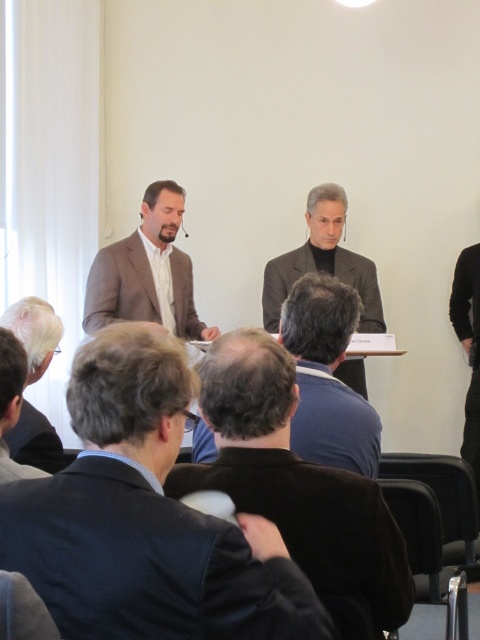
Question: Based on their relative distances, which object is farther from the black velvet jacket at center?

Choices:
 (A) dark brown suit at lower left
 (B) black fabric jacket at right
 (C) dark gray wool suit at lower left
 (D) dark brown hair at center

Answer: (B)

Question: Estimate the real-world distances between objects in this image. Which object is farther from the matte brown suit at center?

Choices:
 (A) dark brown hair at center
 (B) dark gray textured suit at center
 (C) dark brown suit at lower left

Answer: (C)

Question: Can you confirm if dark gray textured suit at center is bigger than dark gray wool suit at lower left?

Choices:
 (A) no
 (B) yes

Answer: (B)

Question: Which point is farther from the camera taking this photo?

Choices:
 (A) (32, 429)
 (B) (347, 272)
 (C) (46, 580)

Answer: (B)

Question: Does black velvet jacket at center appear under white hair at lower left?

Choices:
 (A) yes
 (B) no

Answer: (A)

Question: Does matte brown suit at center have a larger size compared to white hair at lower left?

Choices:
 (A) no
 (B) yes

Answer: (B)